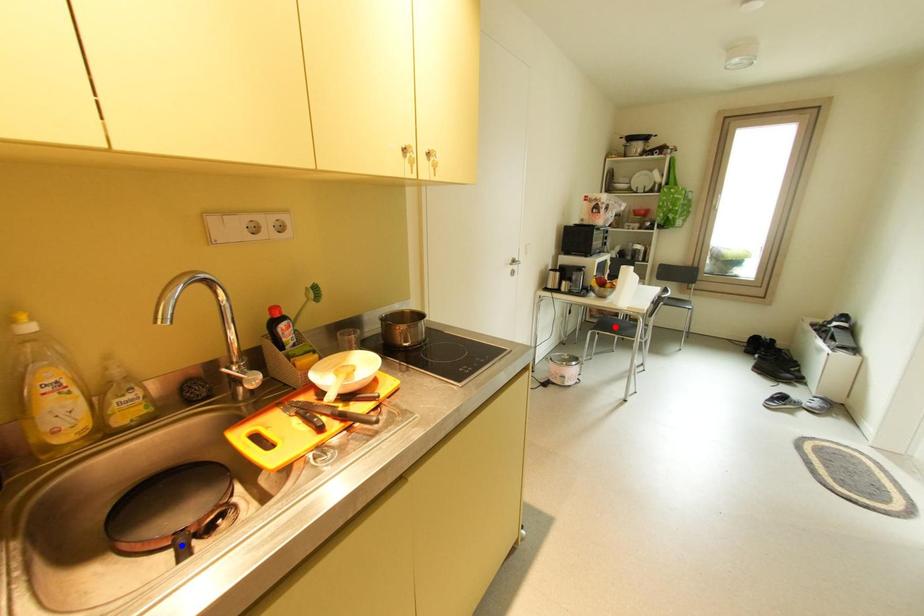
Question: In the image, two points are highlighted. Which point is nearer to the camera? Reply with the corresponding letter.

Choices:
 (A) blue point
 (B) red point

Answer: (A)